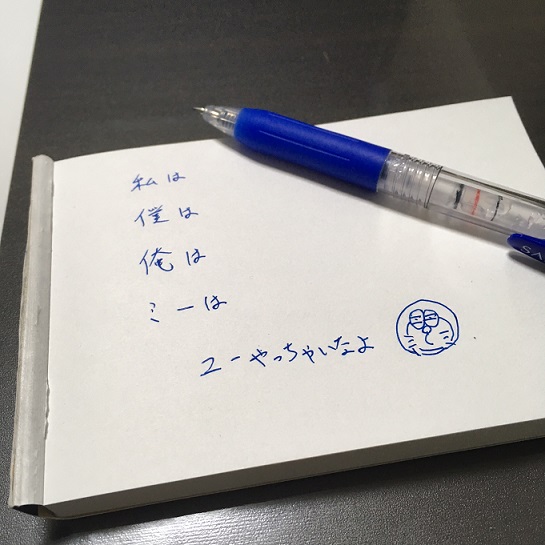
Where is `pad of paper`? Image resolution: width=545 pixels, height=545 pixels. pad of paper is located at coordinates (230, 426).